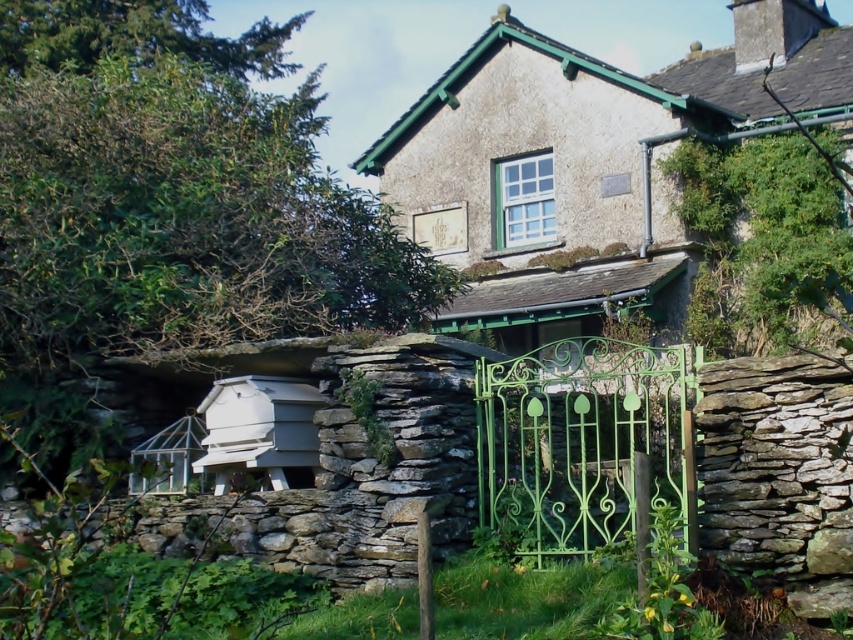
You are standing at a point 82.03 feet away from the cottage. If you want to approach the cottage, which direction should you move relative to the point labeled as point (x=630, y=152)?

Since you are 82.03 feet away from the cottage at point (x=630, y=152), you should move towards the cottage by heading in the direction opposite to the point to get closer.

From the picture: You are a painter standing at the edge of the property. You want to paint both the rustic stone cottage at center and the green wrought iron gate at center. Which object should you focus on first if you want to paint the taller one first?

The rustic stone cottage at center has a greater height compared to the green wrought iron gate at center, so you should focus on painting the rustic stone cottage at center first.